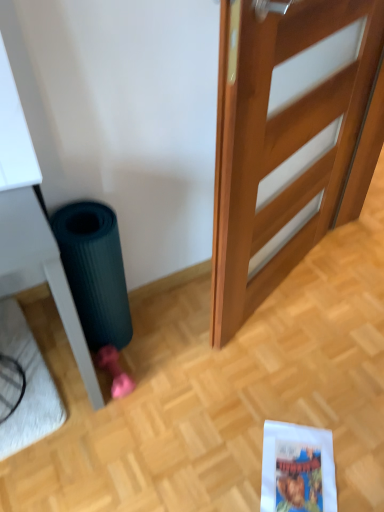
Image resolution: width=384 pixels, height=512 pixels. Identify the location of vacant space in front of dark green rubber mat at lower left. (116, 380).